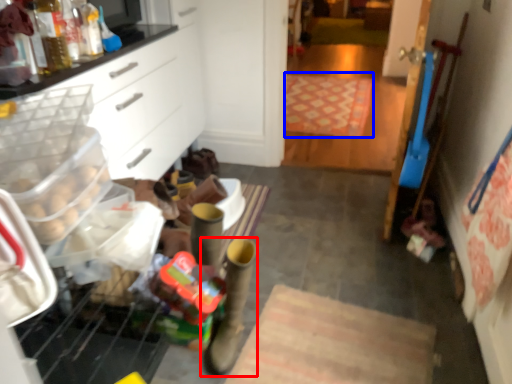
Question: Among these objects, which one is farthest to the camera, footwear (highlighted by a red box) or mat (highlighted by a blue box)?

Choices:
 (A) footwear
 (B) mat

Answer: (B)